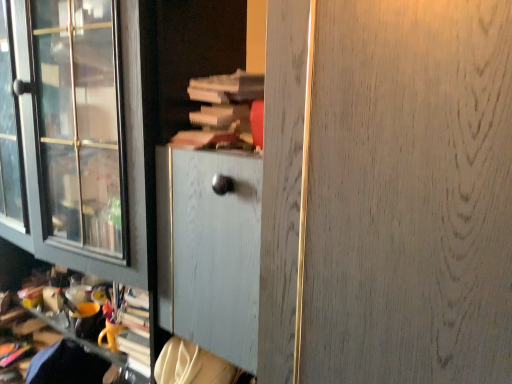
Question: From the image's perspective, is wooden book at center under white wood screen door at center?

Choices:
 (A) no
 (B) yes

Answer: (A)

Question: Does wooden book at center come in front of white wood screen door at center?

Choices:
 (A) yes
 (B) no

Answer: (B)

Question: From a real-world perspective, is wooden book at center physically below white wood screen door at center?

Choices:
 (A) yes
 (B) no

Answer: (B)

Question: Considering the relative sizes of wooden book at center and white wood screen door at center in the image provided, is wooden book at center taller than white wood screen door at center?

Choices:
 (A) yes
 (B) no

Answer: (B)

Question: Is wooden book at center oriented away from white wood screen door at center?

Choices:
 (A) yes
 (B) no

Answer: (B)

Question: Can you confirm if wooden book at center is positioned to the left of white wood screen door at center?

Choices:
 (A) yes
 (B) no

Answer: (A)

Question: From a real-world perspective, is white wood screen door at center on wooden book at center?

Choices:
 (A) yes
 (B) no

Answer: (B)

Question: Is the depth of white wood screen door at center less than that of wooden book at center?

Choices:
 (A) yes
 (B) no

Answer: (A)

Question: From a real-world perspective, is white wood screen door at center positioned under wooden book at center based on gravity?

Choices:
 (A) no
 (B) yes

Answer: (B)

Question: Can you confirm if white wood screen door at center is thinner than wooden book at center?

Choices:
 (A) no
 (B) yes

Answer: (A)

Question: Is white wood screen door at center next to wooden book at center and touching it?

Choices:
 (A) no
 (B) yes

Answer: (A)

Question: Are white wood screen door at center and wooden book at center far apart?

Choices:
 (A) no
 (B) yes

Answer: (A)

Question: Based on their positions, is wooden book at center located to the left or right of white wood screen door at center?

Choices:
 (A) right
 (B) left

Answer: (B)